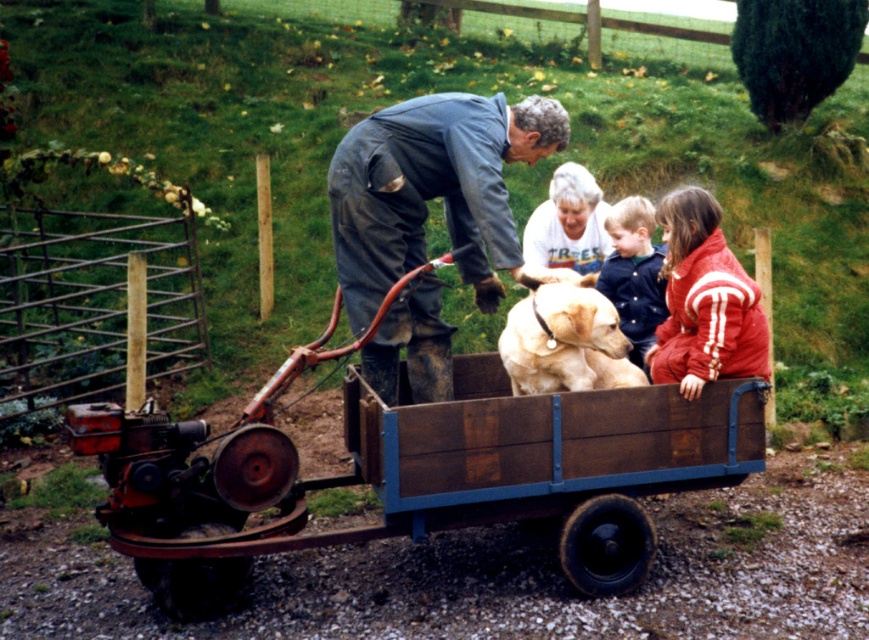
Does dark blue coveralls at center appear over golden fur dog at center?

Yes, dark blue coveralls at center is above golden fur dog at center.

I want to click on dark blue coveralls at center, so click(x=432, y=189).

Between point (438, 378) and point (542, 392), which one is positioned in front?

Positioned in front is point (542, 392).

The width and height of the screenshot is (869, 640). Identify the location of dark blue coveralls at center. [x=432, y=189].

Is point (408, 125) positioned behind point (701, 301)?

That is True.

Does dark blue coveralls at center have a larger size compared to red fleece jacket at right?

Indeed, dark blue coveralls at center has a larger size compared to red fleece jacket at right.

Does point (508, 112) lie in front of point (668, 266)?

No, it is not.

Find the location of `dark blue coveralls at center`. dark blue coveralls at center is located at coordinates (432, 189).

Between red fleece jacket at right and golden fur dog at center, which one is positioned lower?

Positioned lower is golden fur dog at center.

Can you confirm if red fleece jacket at right is positioned to the right of golden fur dog at center?

Correct, you'll find red fleece jacket at right to the right of golden fur dog at center.

Image resolution: width=869 pixels, height=640 pixels. What are the coordinates of `red fleece jacket at right` in the screenshot? It's located at (704, 300).